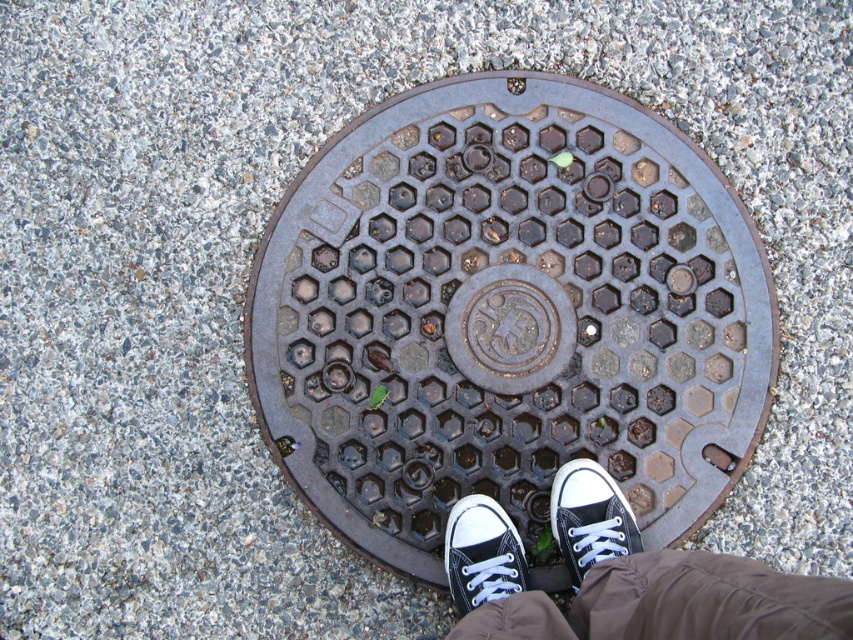
Who is more distant from viewer, (587, 532) or (461, 538)?

Positioned behind is point (461, 538).

Measure the distance from black canvas shoe at center to white canvas shoe at center.

A distance of 5.32 inches exists between black canvas shoe at center and white canvas shoe at center.

Find the location of a particular element. Image resolution: width=853 pixels, height=640 pixels. black canvas shoe at center is located at coordinates (590, 516).

Locate an element on the screen. The width and height of the screenshot is (853, 640). black canvas shoe at center is located at coordinates [590, 516].

Who is shorter, rusty metal manhole cover at center or white canvas shoe at center?

With less height is white canvas shoe at center.

Does rusty metal manhole cover at center have a lesser width compared to white canvas shoe at center?

Incorrect, rusty metal manhole cover at center's width is not less than white canvas shoe at center's.

I want to click on rusty metal manhole cover at center, so click(509, 328).

Where is `rusty metal manhole cover at center`? The height and width of the screenshot is (640, 853). rusty metal manhole cover at center is located at coordinates [x=509, y=328].

Between rusty metal manhole cover at center and black canvas shoe at center, which one has more height?

rusty metal manhole cover at center is taller.

Between rusty metal manhole cover at center and black canvas shoe at center, which one has less height?

With less height is black canvas shoe at center.

Locate an element on the screen. Image resolution: width=853 pixels, height=640 pixels. rusty metal manhole cover at center is located at coordinates (509, 328).